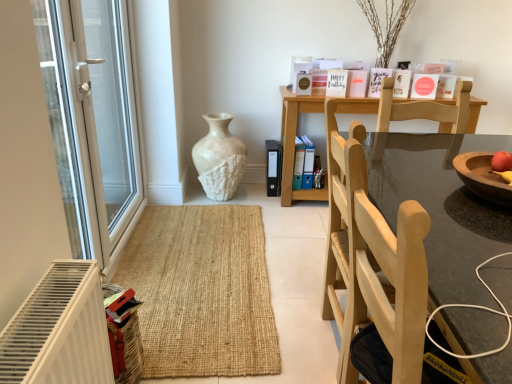
What is the approximate width of transparent glass door at left?

The width of transparent glass door at left is 8.28 inches.

At what (x,y) coordinates should I click in order to perform the action: click on matte white card at upper center, which ranks as the 1th book in front-to-back order. Please return your answer as a coordinate pair (x, y). This screenshot has height=384, width=512. Looking at the image, I should click on (336, 83).

Is point (504, 352) more distant than point (309, 153)?

No, it is not.

How different are the orientations of wooden round table at center and blue plastic file at center, which is counted as the first book, starting from the left, in degrees?

They differ by 87.4 degrees in their facing directions.

Is wooden round table at center in front of or behind blue plastic file at center, which appears as the second book when viewed from the right, in the image?

Clearly, wooden round table at center is in front of blue plastic file at center, which appears as the second book when viewed from the right.

Which of these two, wooden round table at center or blue plastic file at center, the second book positioned from the front, is bigger?

With larger size is wooden round table at center.

Is matte white card at upper center, the second book in the left-to-right sequence, oriented towards blue plastic file at center, which appears as the 1th book when ordered from the bottom?

No, matte white card at upper center, the second book in the left-to-right sequence, is not aimed at blue plastic file at center, which appears as the 1th book when ordered from the bottom.

You are a GUI agent. You are given a task and a screenshot of the screen. Output one action in this format:
    pyautogui.click(x=<x>, y=<y>)
    Task: Click on the book in front of the blue plastic file at center, the second book positioned from the front
    
    Given the screenshot: What is the action you would take?
    pyautogui.click(x=336, y=83)

Is the depth of matte white card at upper center, the second book in the back-to-front sequence, greater than that of blue plastic file at center, which ranks as the second book in top-to-bottom order?

No, matte white card at upper center, the second book in the back-to-front sequence, is closer to the camera.

Is matte white card at upper center, positioned as the 1th book in top-to-bottom order, surrounding blue plastic file at center, the first book positioned from the back?

No, blue plastic file at center, the first book positioned from the back, is not inside matte white card at upper center, positioned as the 1th book in top-to-bottom order.

Is point (344, 74) closer or farther from the camera than point (217, 175)?

Point (344, 74) is positioned closer to the camera compared to point (217, 175).

From a real-world perspective, is matte white card at upper center, positioned as the 1th book in top-to-bottom order, above or below white textured vase at center?

From a real-world perspective, matte white card at upper center, positioned as the 1th book in top-to-bottom order, is physically above white textured vase at center.

Considering the sizes of objects matte white card at upper center, the second book in the left-to-right sequence, and white textured vase at center in the image provided, who is smaller, matte white card at upper center, the second book in the left-to-right sequence, or white textured vase at center?

Smaller between the two is matte white card at upper center, the second book in the left-to-right sequence.

Between matte white card at upper center, the second book in the back-to-front sequence, and white textured vase at center, which one has smaller width?

With smaller width is matte white card at upper center, the second book in the back-to-front sequence.

Who is smaller, transparent glass door at left or white textured vase at center?

white textured vase at center.

Considering the sizes of objects transparent glass door at left and white textured vase at center in the image provided, who is thinner, transparent glass door at left or white textured vase at center?

With smaller width is transparent glass door at left.

Consider the image. Is transparent glass door at left in front of white textured vase at center?

That is True.

Are transparent glass door at left and white textured vase at center located far from each other?

No, transparent glass door at left is in close proximity to white textured vase at center.

Considering the sizes of objects matte white card at upper center, the second book in the back-to-front sequence, and transparent glass door at left in the image provided, who is thinner, matte white card at upper center, the second book in the back-to-front sequence, or transparent glass door at left?

Thinner between the two is matte white card at upper center, the second book in the back-to-front sequence.

Based on the photo, can you confirm if matte white card at upper center, the second book in the back-to-front sequence, is positioned to the right of transparent glass door at left?

Correct, you'll find matte white card at upper center, the second book in the back-to-front sequence, to the right of transparent glass door at left.

Is matte white card at upper center, the second book in the left-to-right sequence, completely or partially outside of transparent glass door at left?

Yes, matte white card at upper center, the second book in the left-to-right sequence, is outside of transparent glass door at left.

Consider the image. Between white textured vase at center and wooden round table at center, which one has less height?

Standing shorter between the two is white textured vase at center.

Is white textured vase at center thinner than wooden round table at center?

Correct, the width of white textured vase at center is less than that of wooden round table at center.

Is white textured vase at center bigger than wooden round table at center?

Incorrect, white textured vase at center is not larger than wooden round table at center.

Which object is further away from the camera, wooden round table at center or transparent glass door at left?

transparent glass door at left is further away from the camera.

From a real-world perspective, is wooden round table at center below transparent glass door at left?

Correct, in the physical world, wooden round table at center is lower than transparent glass door at left.

Is transparent glass door at left completely or partially inside wooden round table at center?

No, transparent glass door at left is not inside wooden round table at center.

Does wooden round table at center have a lesser width compared to transparent glass door at left?

In fact, wooden round table at center might be wider than transparent glass door at left.

You are a GUI agent. You are given a task and a screenshot of the screen. Output one action in this format:
    pyautogui.click(x=<x>, y=<y>)
    Task: Click on the round table on the right of blue plastic file at center, the second book positioned from the front
    
    Given the screenshot: What is the action you would take?
    pyautogui.click(x=441, y=206)

Image resolution: width=512 pixels, height=384 pixels. What are the coordinates of `book behind the matte white card at upper center, which ranks as the 1th book in front-to-back order` in the screenshot? It's located at click(303, 163).

Based on their spatial positions, is matte white card at upper center, which is the 2th book in bottom-to-top order, or transparent glass door at left further from blue plastic file at center, which is counted as the first book, starting from the left?

transparent glass door at left is positioned further to the anchor blue plastic file at center, which is counted as the first book, starting from the left.

Considering their positions, is matte white card at upper center, positioned as the 1th book in top-to-bottom order, positioned closer to wooden round table at center than blue plastic file at center, the second book positioned from the front?

Among the two, matte white card at upper center, positioned as the 1th book in top-to-bottom order, is located nearer to wooden round table at center.

From the image, which object appears to be nearer to matte white card at upper center, acting as the 1th book starting from the right, blue plastic file at center, which is counted as the first book, starting from the left, or transparent glass door at left?

blue plastic file at center, which is counted as the first book, starting from the left, lies closer to matte white card at upper center, acting as the 1th book starting from the right, than the other object.

Which object lies nearer to the anchor point wooden round table at center, transparent glass door at left or white textured vase at center?

Based on the image, transparent glass door at left appears to be nearer to wooden round table at center.

Based on their spatial positions, is matte white card at upper center, which is the 2th book in bottom-to-top order, or white textured vase at center closer to blue plastic file at center, which ranks as the second book in top-to-bottom order?

Based on the image, matte white card at upper center, which is the 2th book in bottom-to-top order, appears to be nearer to blue plastic file at center, which ranks as the second book in top-to-bottom order.

Which object lies nearer to the anchor point transparent glass door at left, blue plastic file at center, the first book positioned from the back, or wooden round table at center?

Based on the image, wooden round table at center appears to be nearer to transparent glass door at left.

When comparing their distances from matte white card at upper center, which ranks as the 1th book in front-to-back order, does transparent glass door at left or white textured vase at center seem further?

Based on the image, transparent glass door at left appears to be further to matte white card at upper center, which ranks as the 1th book in front-to-back order.

Looking at the image, which one is located further to transparent glass door at left, white textured vase at center or matte white card at upper center, positioned as the 1th book in top-to-bottom order?

The object further to transparent glass door at left is matte white card at upper center, positioned as the 1th book in top-to-bottom order.

Identify the location of vase situated between transparent glass door at left and matte white card at upper center, the second book in the left-to-right sequence, from left to right. The height and width of the screenshot is (384, 512). (219, 158).

Find the location of a particular element. book located between white textured vase at center and matte white card at upper center, which ranks as the 1th book in front-to-back order, in the left-right direction is located at coordinates (303, 163).

What are the coordinates of `vase located between wooden round table at center and blue plastic file at center, which appears as the second book when viewed from the right, in the depth direction` in the screenshot? It's located at (219, 158).

Identify the location of book located between wooden round table at center and white textured vase at center in the depth direction. The width and height of the screenshot is (512, 384). (336, 83).